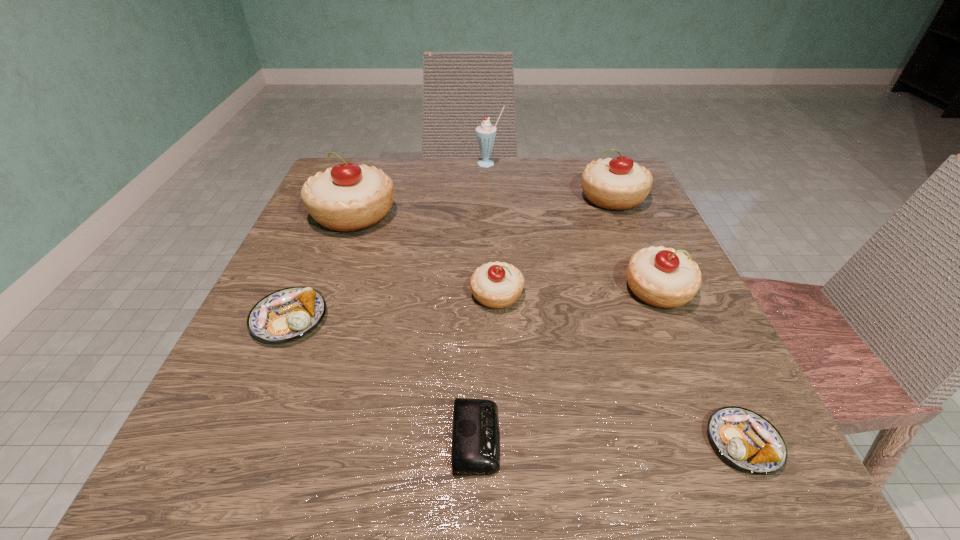
Identify the location of the farther brown pastry. The image size is (960, 540). (287, 314).

Find the location of a particular element. The width and height of the screenshot is (960, 540). the sixth tallest object is located at coordinates (287, 314).

Find the location of a particular element. The width and height of the screenshot is (960, 540). the nearer brown pastry is located at coordinates (747, 440).

Locate an element on the screen. The width and height of the screenshot is (960, 540). the shortest pastry is located at coordinates (747, 440).

The height and width of the screenshot is (540, 960). I want to click on the shortest object, so click(475, 451).

Image resolution: width=960 pixels, height=540 pixels. Identify the location of free space located 0.280m on the straw side of the milkshake. (492, 237).

Image resolution: width=960 pixels, height=540 pixels. Find the location of `free spot located 0.070m on the front of the leftmost beige pastry`. free spot located 0.070m on the front of the leftmost beige pastry is located at coordinates (335, 262).

At what (x,y) coordinates should I click in order to perform the action: click on free region located 0.360m on the front of the fifth shortest pastry. Please return your answer as a coordinate pair (x, y). Looking at the image, I should click on tap(677, 353).

The width and height of the screenshot is (960, 540). I want to click on free space located 0.270m on the back of the third biggest beige pastry, so click(x=614, y=190).

Locate an element on the screen. The height and width of the screenshot is (540, 960). free space located on the front of the smallest beige pastry is located at coordinates (500, 369).